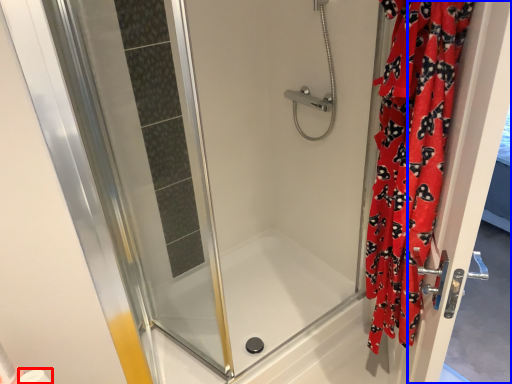
Question: Which object appears closest to the camera in this image, toilet paper (highlighted by a red box) or screen door (highlighted by a blue box)?

Choices:
 (A) toilet paper
 (B) screen door

Answer: (B)